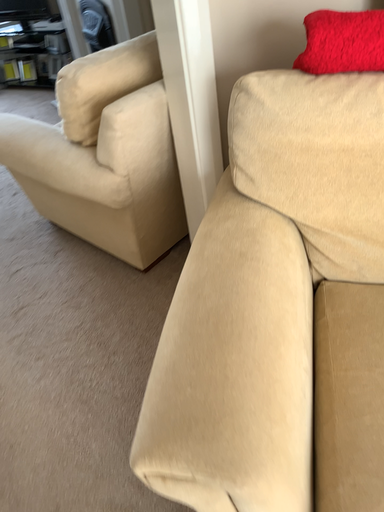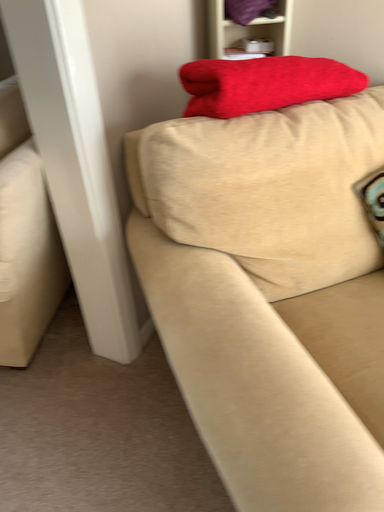
Question: How did the camera likely rotate when shooting the video?

Choices:
 (A) rotated left
 (B) rotated right

Answer: (B)